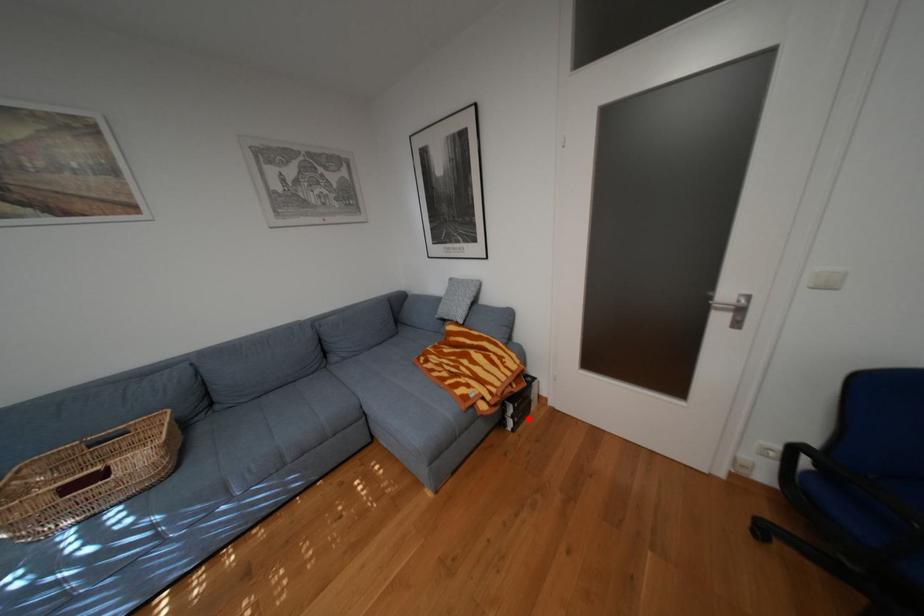
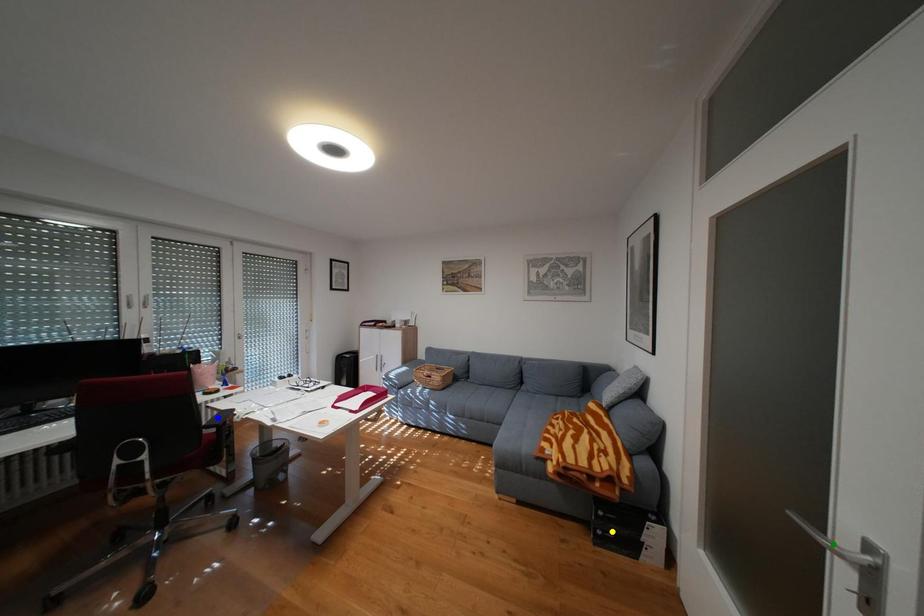
Question: I am providing you with two images of the same scene from different viewpoints. A red point is marked on the first image. You are given multiple points on the second image. Which point in image 2 is actually the same real-world point as the red point in image 1?

Choices:
 (A) blue point
 (B) yellow point
 (C) green point

Answer: (B)